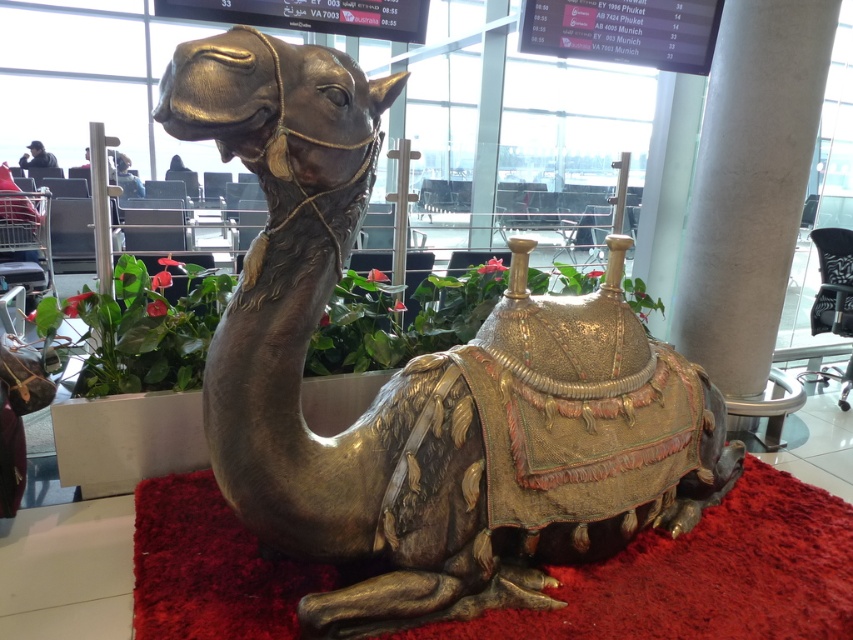
The image size is (853, 640). I want to click on gold metallic camel at center, so click(422, 380).

This screenshot has width=853, height=640. What do you see at coordinates (422, 380) in the screenshot? I see `gold metallic camel at center` at bounding box center [422, 380].

Which is behind, point (386, 428) or point (202, 611)?

The point (202, 611) is behind.

Locate an element on the screen. Image resolution: width=853 pixels, height=640 pixels. gold metallic camel at center is located at coordinates (422, 380).